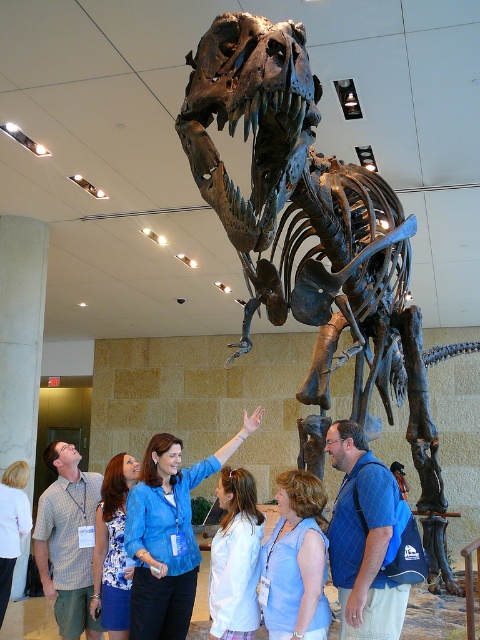
Question: Observing the image, what is the correct spatial positioning of white cotton shirt at center in reference to blue fabric dress at lower left?

Choices:
 (A) above
 (B) below

Answer: (A)

Question: Is blue shirt at center thinner than blue shirt at upper center?

Choices:
 (A) no
 (B) yes

Answer: (A)

Question: Is shiny metallic skeleton at center further to the viewer compared to blue fabric shirt at center?

Choices:
 (A) no
 (B) yes

Answer: (A)

Question: Which of the following is the closest to the observer?

Choices:
 (A) blue shirt at center
 (B) white cotton shirt at center
 (C) blue plaid shirt at center
 (D) blue shirt at upper center

Answer: (C)

Question: Among these objects, which one is farthest from the camera?

Choices:
 (A) blue shirt at upper center
 (B) shiny metallic skeleton at center

Answer: (A)

Question: Which object is closer to the camera taking this photo?

Choices:
 (A) blue fabric shirt at center
 (B) white fabric shirt at lower left
 (C) shiny metallic skeleton at center

Answer: (C)